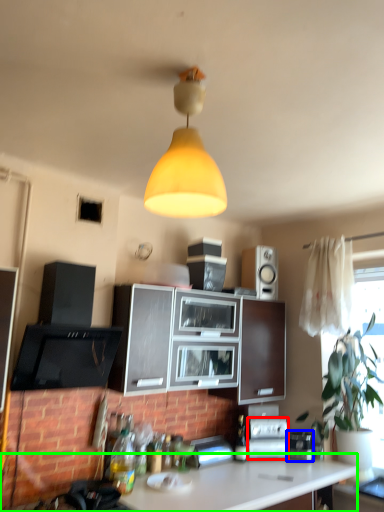
Question: Considering the real-world distances, which object is closest to appliance (highlighted by a red box)? appliance (highlighted by a blue box) or countertop (highlighted by a green box).

Choices:
 (A) appliance
 (B) countertop

Answer: (A)